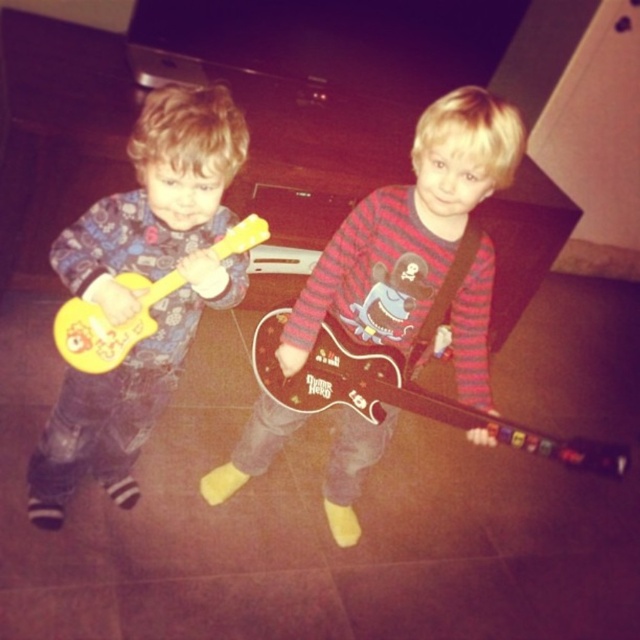
The width and height of the screenshot is (640, 640). Describe the element at coordinates (134, 296) in the screenshot. I see `matte yellow toy guitar at left` at that location.

Is matte yellow toy guitar at left in front of yellow matte guitar at left?

Yes, it is.

Between point (120, 424) and point (128, 339), which one is positioned behind?

The point (120, 424) is more distant.

Where is `matte yellow toy guitar at left`? The image size is (640, 640). matte yellow toy guitar at left is located at coordinates (134, 296).

Between matte brown guitar at center and matte yellow toy guitar at left, which one has more height?

matte brown guitar at center

Which is in front, point (458, 116) or point (179, 246)?

Point (458, 116)

The width and height of the screenshot is (640, 640). I want to click on matte brown guitar at center, so click(x=408, y=228).

Which is more to the left, glossy plastic guitar at center or yellow matte guitar at left?

yellow matte guitar at left

Is glossy plastic guitar at center thinner than yellow matte guitar at left?

Incorrect, glossy plastic guitar at center's width is not less than yellow matte guitar at left's.

Does point (344, 337) come closer to viewer compared to point (67, 353)?

No, it is behind (67, 353).

I want to click on glossy plastic guitar at center, so click(401, 390).